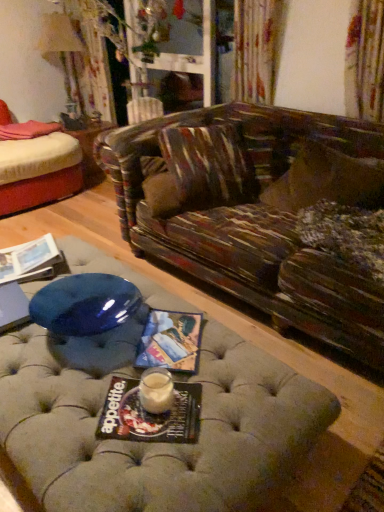
Question: Can you confirm if matte paper magazine at lower left, which is the first magazine from top to bottom, is smaller than matte black magazine at center, which appears as the second magazine when viewed from the right?

Choices:
 (A) yes
 (B) no

Answer: (B)

Question: Is matte paper magazine at lower left, marked as the 1th magazine in a left-to-right arrangement, taller than matte black magazine at center, acting as the 2th magazine starting from the left?

Choices:
 (A) yes
 (B) no

Answer: (A)

Question: Is matte paper magazine at lower left, marked as the 1th magazine in a left-to-right arrangement, positioned with its back to matte black magazine at center, which is the first magazine from bottom to top?

Choices:
 (A) no
 (B) yes

Answer: (A)

Question: From the image's perspective, does matte paper magazine at lower left, which is the 1th magazine from back to front, appear lower than matte black magazine at center, which is the first magazine from bottom to top?

Choices:
 (A) yes
 (B) no

Answer: (B)

Question: From a real-world perspective, is matte paper magazine at lower left, marked as the 1th magazine in a left-to-right arrangement, on matte black magazine at center, acting as the 2th magazine starting from the left?

Choices:
 (A) no
 (B) yes

Answer: (B)

Question: Is fluffy brown pillow at right spatially inside matte paper magazine at center, which ranks as the 2th magazine in top-to-bottom order, or outside of it?

Choices:
 (A) inside
 (B) outside

Answer: (B)

Question: In the image, is fluffy brown pillow at right positioned in front of or behind matte paper magazine at center, which ranks as the 2th magazine in top-to-bottom order?

Choices:
 (A) front
 (B) behind

Answer: (B)

Question: From a real-world perspective, is fluffy brown pillow at right positioned above or below matte paper magazine at center, acting as the 1th magazine starting from the right?

Choices:
 (A) below
 (B) above

Answer: (B)

Question: Is point (311, 202) closer or farther from the camera than point (147, 347)?

Choices:
 (A) closer
 (B) farther

Answer: (B)

Question: Looking at the image, does fluffy brown pillow at right seem bigger or smaller compared to matte black magazine at center, the third magazine when ordered from back to front?

Choices:
 (A) big
 (B) small

Answer: (A)

Question: Would you say fluffy brown pillow at right is to the left or to the right of matte black magazine at center, the third magazine when ordered from back to front, in the picture?

Choices:
 (A) right
 (B) left

Answer: (A)

Question: From the image's perspective, is fluffy brown pillow at right located above or below matte black magazine at center, which is the first magazine from bottom to top?

Choices:
 (A) below
 (B) above

Answer: (B)

Question: From a real-world perspective, is fluffy brown pillow at right physically located above or below matte black magazine at center, which is the first magazine from front to back?

Choices:
 (A) above
 (B) below

Answer: (A)

Question: From their relative heights in the image, would you say matte black magazine at center, arranged as the third magazine when viewed from the top, is taller or shorter than matte cream lampshade at upper left?

Choices:
 (A) short
 (B) tall

Answer: (A)

Question: Would you say matte black magazine at center, which is the first magazine from bottom to top, is inside or outside matte cream lampshade at upper left?

Choices:
 (A) inside
 (B) outside

Answer: (B)